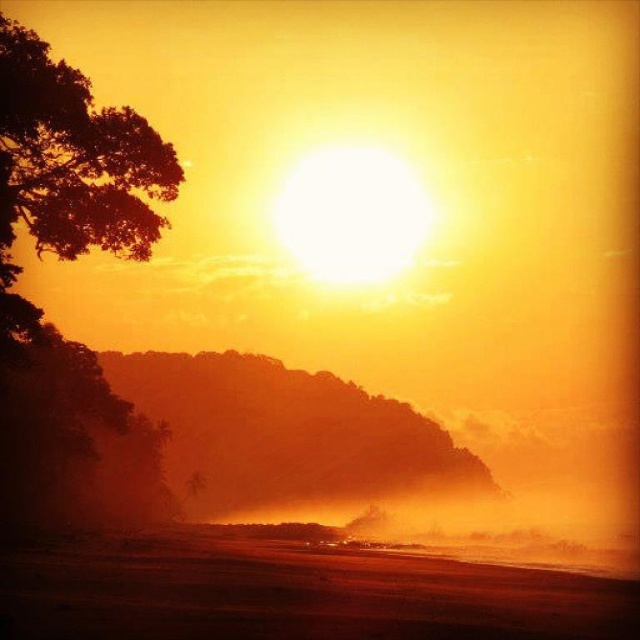
You are standing on the sandy shore at lower center and want to walk towards the silhouetted leafy tree at left. Which direction should you face to move directly towards it?

You should face to the left because the sandy shore at lower center is to the right of the silhouetted leafy tree at left, so moving left will take you directly towards the tree.

You are a photographer trying to capture the sunset. You notice the sandy shore at lower center and the silhouetted leafy tree at left in your viewfinder. Which object appears larger in height in the photo?

The sandy shore at lower center appears much taller than the silhouetted leafy tree at left in the photo.